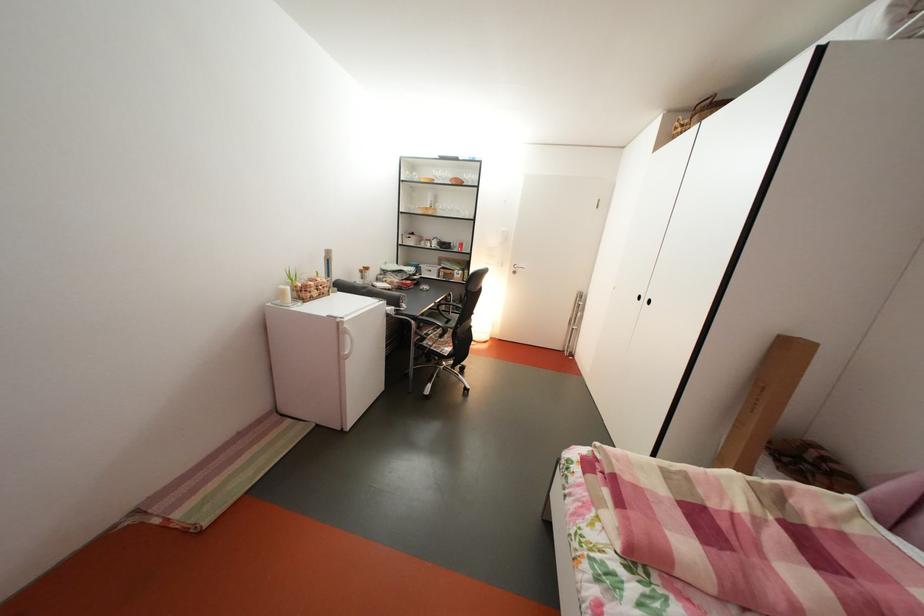
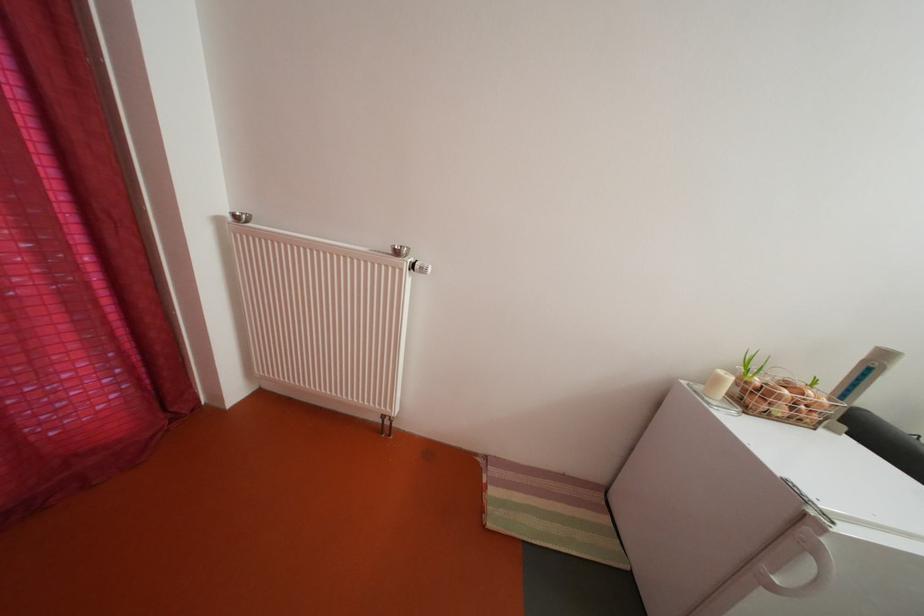
Locate, in the second image, the point that corresponds to pixel 359 363 in the first image.

(784, 594)